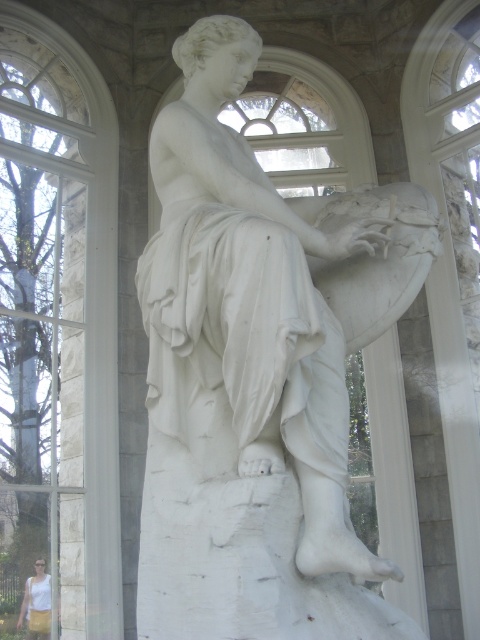
You are an art conservator examining the statue from the front. You notice two points on the statue marked at coordinates point (215, 401) and point (44, 598). Which point is closer to your current viewpoint?

Point (215, 401) is closer to the camera than point (44, 598).

You are standing at the entrance of the stone structure and want to take a photo of the classical marble statue. The clear glass window at upper left might reflect the statue. Is the window close enough to capture a clear reflection?

The clear glass window at upper left is 162.11 feet away from the camera. Since reflections require proximity to clearly show the subject, the window is too far to capture a clear reflection of the classical marble statue.